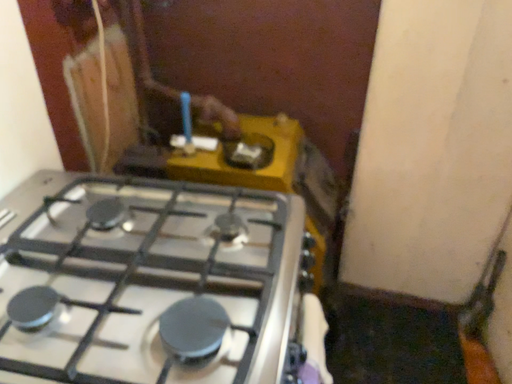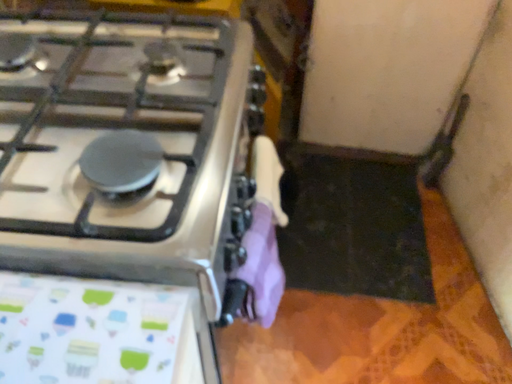
Question: How did the camera likely rotate when shooting the video?

Choices:
 (A) rotated upward
 (B) rotated downward

Answer: (B)